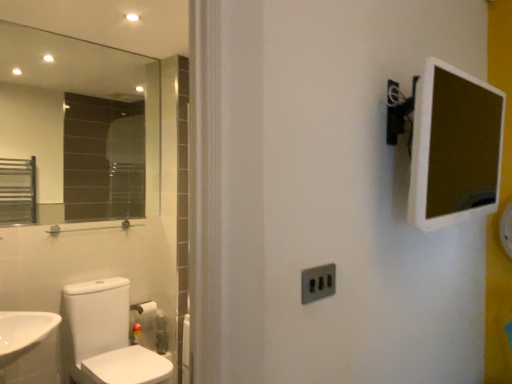
What is the approximate width of satin silver switch at center?

satin silver switch at center is 0.66 inches wide.

The width and height of the screenshot is (512, 384). I want to click on clear glass mirror at upper left, so click(x=82, y=123).

This screenshot has width=512, height=384. In order to click on white plastic mirror at upper right in this screenshot , I will do `click(454, 147)`.

Measure the distance between white plastic mirror at upper right and camera.

They are 3.64 feet apart.

Locate an element on the screen. satin silver switch at center is located at coordinates (317, 283).

Can you see white plastic mirror at upper right touching white glossy toilet at lower left?

No.

Find the location of a particular element. The width and height of the screenshot is (512, 384). medicine cabinet in front of the white glossy toilet at lower left is located at coordinates (454, 147).

Is white plastic mirror at upper right looking in the opposite direction of white glossy toilet at lower left?

No, white plastic mirror at upper right's orientation is not away from white glossy toilet at lower left.

Which of these two, white plastic mirror at upper right or white glossy toilet at lower left, is thinner?

With smaller width is white plastic mirror at upper right.

Considering the positions of objects white glossy toilet at lower left and satin silver switch at center in the image provided, who is more to the right, white glossy toilet at lower left or satin silver switch at center?

satin silver switch at center is more to the right.

Considering the sizes of objects white glossy toilet at lower left and satin silver switch at center in the image provided, who is wider, white glossy toilet at lower left or satin silver switch at center?

Wider between the two is white glossy toilet at lower left.

Is point (87, 308) less distant than point (325, 278)?

No, (87, 308) is behind (325, 278).

Locate an element on the screen. mirror above the white plastic mirror at upper right (from a real-world perspective) is located at coordinates (82, 123).

What's the angular difference between white plastic mirror at upper right and clear glass mirror at upper left's facing directions?

1.26 degrees separate the facing orientations of white plastic mirror at upper right and clear glass mirror at upper left.

Looking at the image, does white plastic mirror at upper right seem bigger or smaller compared to clear glass mirror at upper left?

Clearly, white plastic mirror at upper right is larger in size than clear glass mirror at upper left.

From the image's perspective, is white plastic mirror at upper right above or below clear glass mirror at upper left?

From the image's perspective, white plastic mirror at upper right appears below clear glass mirror at upper left.

Could white glossy toilet at lower left be considered to be inside satin silver switch at center?

No, white glossy toilet at lower left is not a part of satin silver switch at center.

Is satin silver switch at center not close to white glossy toilet at lower left?

Yes.

Find the location of a particular element. toilet on the left of satin silver switch at center is located at coordinates (106, 336).

Is satin silver switch at center positioned in front of white glossy toilet at lower left?

Yes, satin silver switch at center is closer to the camera.

Does white glossy toilet at lower left have a larger size compared to clear glass mirror at upper left?

Indeed, white glossy toilet at lower left has a larger size compared to clear glass mirror at upper left.

How different are the orientations of white glossy toilet at lower left and clear glass mirror at upper left in degrees?

The angular difference between white glossy toilet at lower left and clear glass mirror at upper left is 2.45 degrees.

From the picture: Is white glossy toilet at lower left positioned far away from clear glass mirror at upper left?

That's right, there is a large distance between white glossy toilet at lower left and clear glass mirror at upper left.

Considering the relative positions of white glossy toilet at lower left and clear glass mirror at upper left in the image provided, is white glossy toilet at lower left in front of clear glass mirror at upper left?

That is True.

Looking at their sizes, would you say white plastic mirror at upper right is wider or thinner than satin silver switch at center?

Considering their sizes, white plastic mirror at upper right looks broader than satin silver switch at center.

Considering the sizes of objects white plastic mirror at upper right and satin silver switch at center in the image provided, who is bigger, white plastic mirror at upper right or satin silver switch at center?

Bigger between the two is white plastic mirror at upper right.

Which of these two, white plastic mirror at upper right or satin silver switch at center, stands taller?

Standing taller between the two is white plastic mirror at upper right.

Is white plastic mirror at upper right next to satin silver switch at center?

white plastic mirror at upper right and satin silver switch at center are clearly separated.

From the image's perspective, which one is positioned higher, white glossy toilet at lower left or white plastic mirror at upper right?

From the image's view, white plastic mirror at upper right is above.

Which is more to the right, white glossy toilet at lower left or white plastic mirror at upper right?

Positioned to the right is white plastic mirror at upper right.

Identify the location of toilet below the white plastic mirror at upper right (from a real-world perspective). This screenshot has height=384, width=512. (106, 336).

From a real-world perspective, between white glossy toilet at lower left and white plastic mirror at upper right, who is vertically higher?

white plastic mirror at upper right.

Locate an element on the screen. medicine cabinet that appears above the white glossy toilet at lower left (from a real-world perspective) is located at coordinates (454, 147).

The width and height of the screenshot is (512, 384). Find the location of `electric outlet above the white glossy toilet at lower left (from the image's perspective)`. electric outlet above the white glossy toilet at lower left (from the image's perspective) is located at coordinates (317, 283).

From the image, which object appears to be farther from white glossy toilet at lower left, white plastic mirror at upper right or clear glass mirror at upper left?

Based on the image, white plastic mirror at upper right appears to be further to white glossy toilet at lower left.

From the picture: Considering their positions, is satin silver switch at center positioned closer to clear glass mirror at upper left than white glossy toilet at lower left?

white glossy toilet at lower left is closer to clear glass mirror at upper left.

Estimate the real-world distances between objects in this image. Which object is further from white glossy toilet at lower left, white plastic mirror at upper right or satin silver switch at center?

white plastic mirror at upper right is positioned further to the anchor white glossy toilet at lower left.

Estimate the real-world distances between objects in this image. Which object is closer to satin silver switch at center, white plastic mirror at upper right or clear glass mirror at upper left?

white plastic mirror at upper right.

Based on their spatial positions, is satin silver switch at center or white glossy toilet at lower left further from white plastic mirror at upper right?

The object further to white plastic mirror at upper right is white glossy toilet at lower left.

Based on their spatial positions, is white plastic mirror at upper right or white glossy toilet at lower left closer to clear glass mirror at upper left?

The object closer to clear glass mirror at upper left is white glossy toilet at lower left.

Based on their spatial positions, is clear glass mirror at upper left or satin silver switch at center further from white plastic mirror at upper right?

Based on the image, clear glass mirror at upper left appears to be further to white plastic mirror at upper right.

Which object lies nearer to the anchor point satin silver switch at center, white glossy toilet at lower left or clear glass mirror at upper left?

white glossy toilet at lower left.

Identify the location of electric outlet between clear glass mirror at upper left and white glossy toilet at lower left in the vertical direction. The height and width of the screenshot is (384, 512). (317, 283).

Locate an element on the screen. This screenshot has height=384, width=512. electric outlet between white glossy toilet at lower left and white plastic mirror at upper right from left to right is located at coordinates (317, 283).

Locate an element on the screen. The image size is (512, 384). toilet between clear glass mirror at upper left and white plastic mirror at upper right is located at coordinates (106, 336).

You are a GUI agent. You are given a task and a screenshot of the screen. Output one action in this format:
    pyautogui.click(x=<x>, y=<y>)
    Task: Click on the electric outlet between clear glass mirror at upper left and white plastic mirror at upper right from left to right
    This screenshot has width=512, height=384.
    Given the screenshot: What is the action you would take?
    pyautogui.click(x=317, y=283)